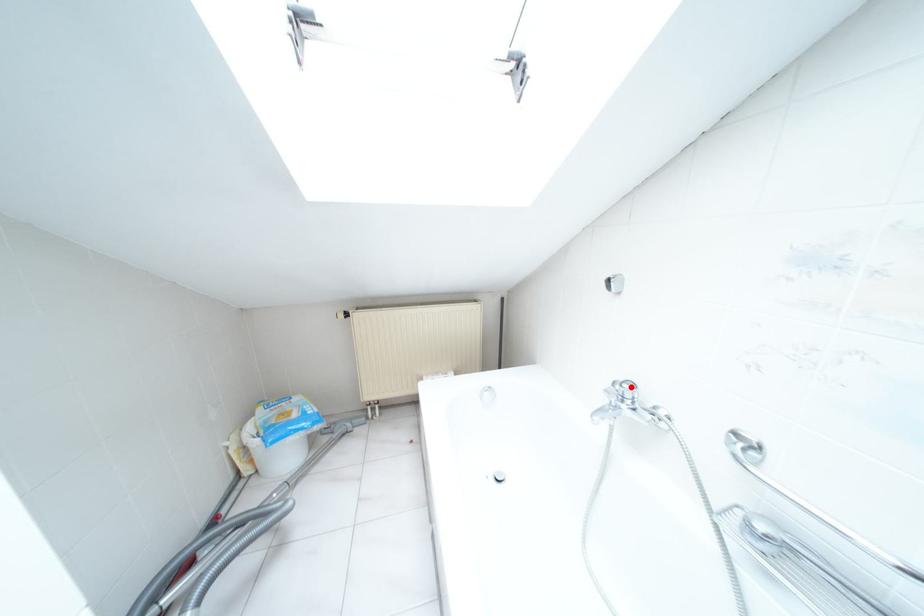
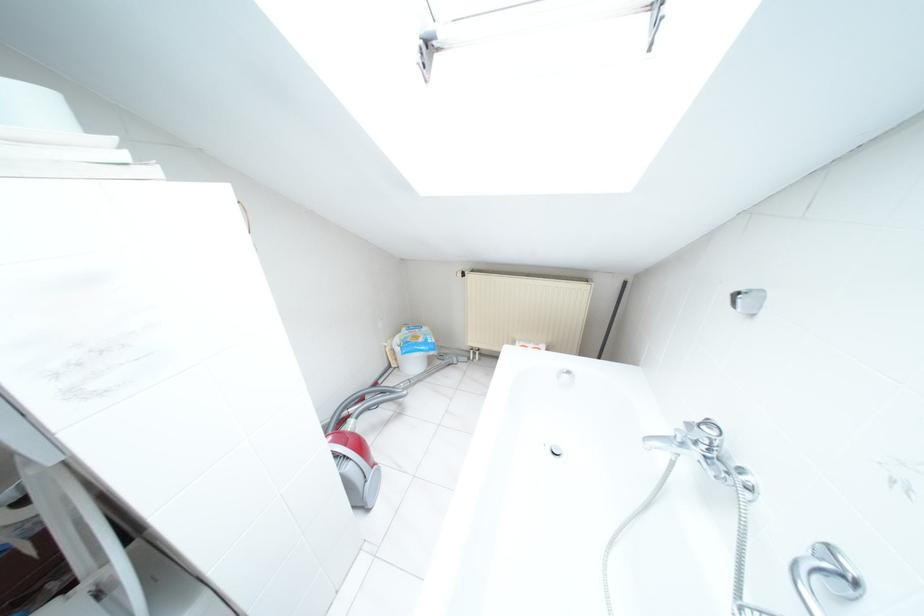
Where in the second image is the point corresponding to the highlighted location from the first image?

(711, 432)